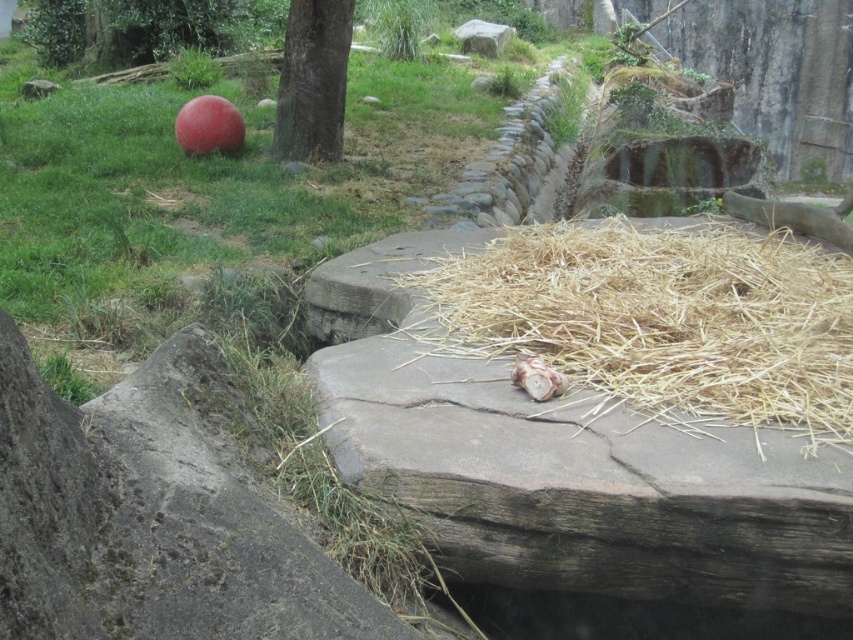
You are a zookeeper who needs to move the brown textured log at center and the smooth gray rock at upper center. Based on their sizes, which object will require more effort to move?

The smooth gray rock at upper center requires more effort to move because it is larger in size than the brown textured log at center.

You are standing in a zoo enclosure and see two points marked in the scene. The first point is at coordinates point (277, 128) and the second is at point (463, 45). Which point is closer to you?

Point (277, 128) is closer to the viewer than point (463, 45).

You are standing at the center of the enclosure and see the point marked at coordinates (662,320). What is located at that point?

The point at coordinates (662,320) marks brown straw at center.